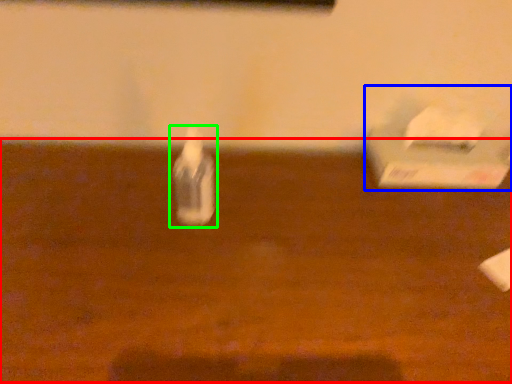
Question: Based on their relative distances, which object is nearer to table (highlighted by a red box)? Choose from box (highlighted by a blue box) and bottle (highlighted by a green box).

Choices:
 (A) box
 (B) bottle

Answer: (B)